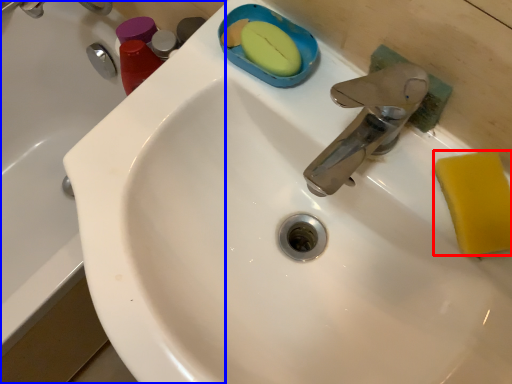
Question: Which of the following is the farthest to the observer, soap (highlighted by a red box) or bath (highlighted by a blue box)?

Choices:
 (A) soap
 (B) bath

Answer: (B)